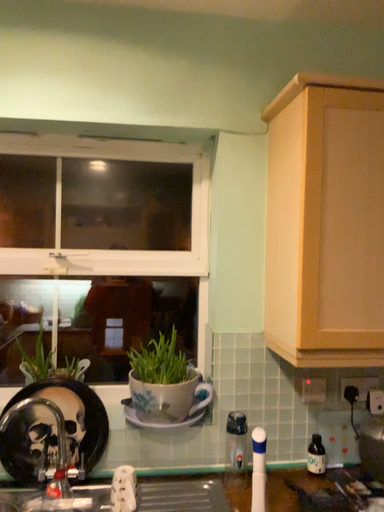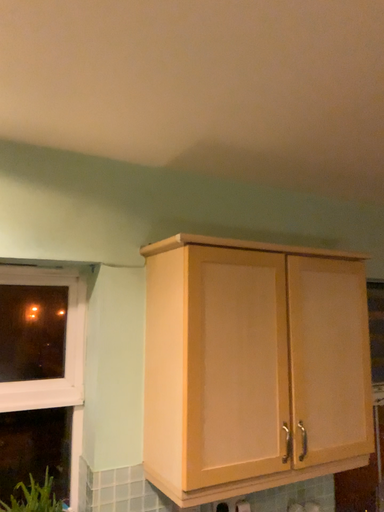
Question: How did the camera likely rotate when shooting the video?

Choices:
 (A) rotated left
 (B) rotated right

Answer: (B)